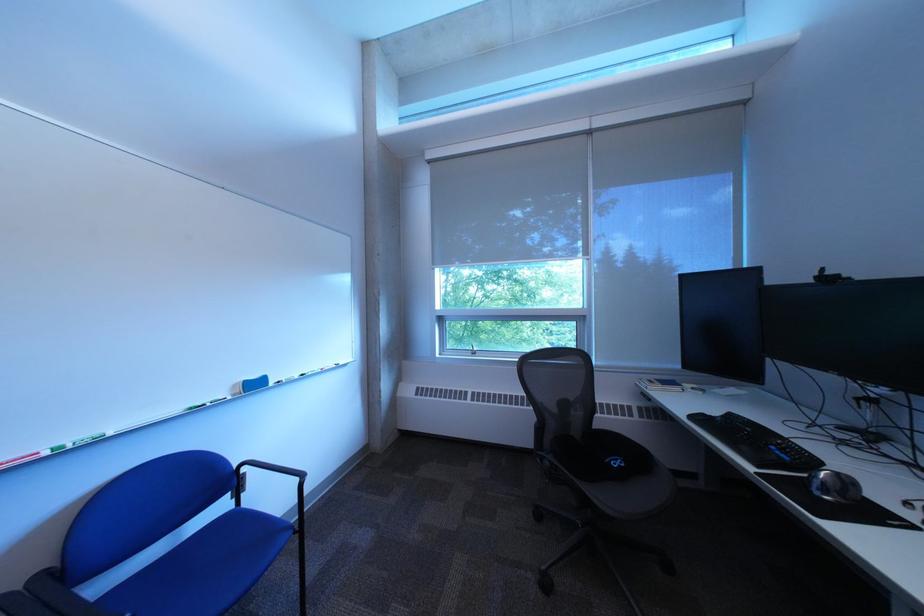
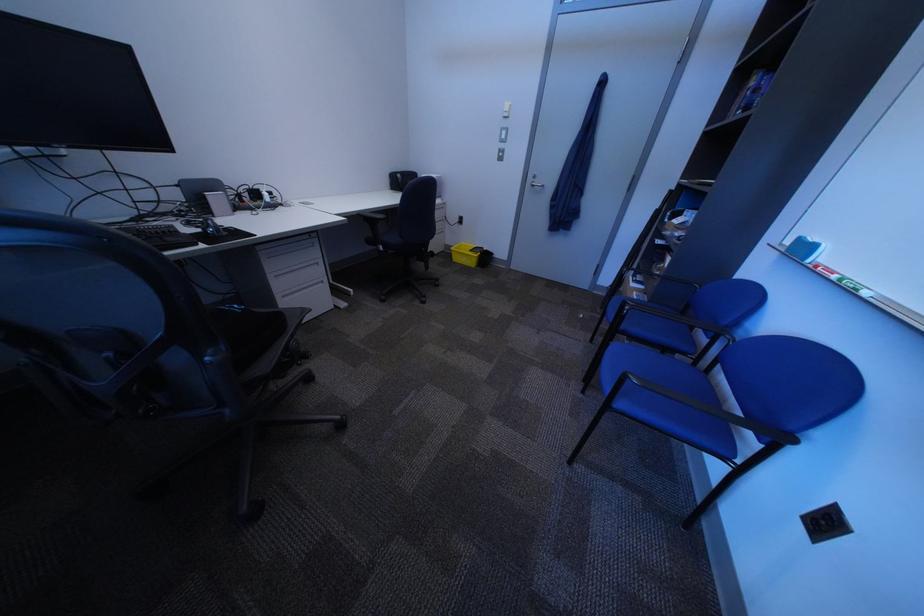
Locate, in the second image, the point that corresponds to pixel 62 455 in the first image.

(849, 278)